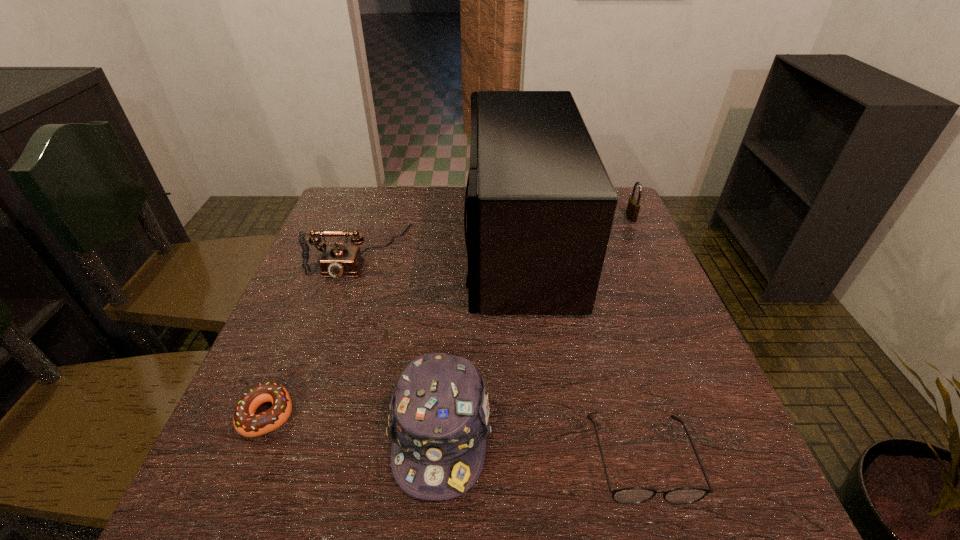
Image resolution: width=960 pixels, height=540 pixels. What are the coordinates of `free spot at the far right corner of the desktop` in the screenshot? It's located at (617, 206).

Locate an element on the screen. This screenshot has width=960, height=540. empty location between the tallest object and the headwear is located at coordinates (480, 337).

Where is `vacant area between the fifth tallest object and the telephone`? The image size is (960, 540). vacant area between the fifth tallest object and the telephone is located at coordinates click(500, 355).

Locate an element on the screen. free area in between the doughnut and the headwear is located at coordinates (354, 423).

Identify the location of free space between the microwave_oven and the fifth tallest object. (580, 350).

Find the location of a particular element. The height and width of the screenshot is (540, 960). free space between the headwear and the spectacles is located at coordinates (540, 445).

Identify the location of vacant area that lies between the telephone and the shortest object. This screenshot has height=540, width=960. (314, 333).

This screenshot has height=540, width=960. I want to click on free point between the doughnut and the headwear, so click(354, 423).

Locate an element on the screen. The height and width of the screenshot is (540, 960). vacant area between the spectacles and the headwear is located at coordinates (540, 445).

Where is `object that is the fourth closest to the telephone`? This screenshot has width=960, height=540. object that is the fourth closest to the telephone is located at coordinates (633, 495).